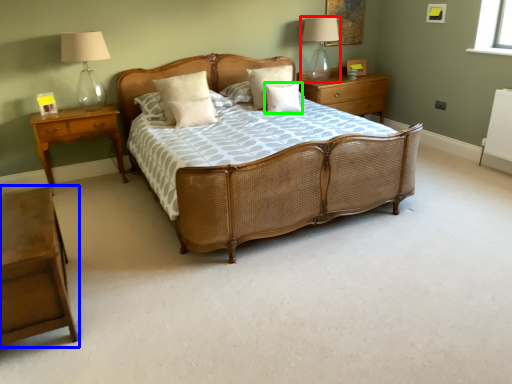
Question: Which is farther away from table lamp (highlighted by a red box)? nightstand (highlighted by a blue box) or pillow (highlighted by a green box)?

Choices:
 (A) nightstand
 (B) pillow

Answer: (A)